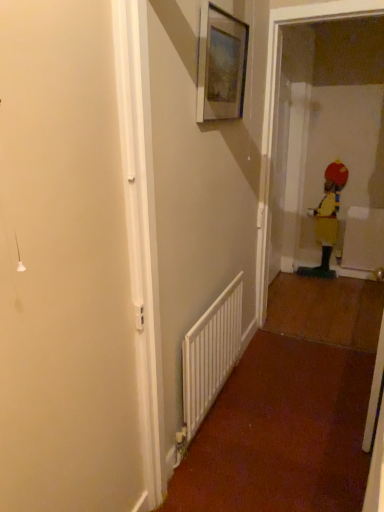
Find the location of a particular element. The height and width of the screenshot is (512, 384). empty space that is ontop of yellow fabric toddler at right (from a real-world perspective) is located at coordinates (335, 156).